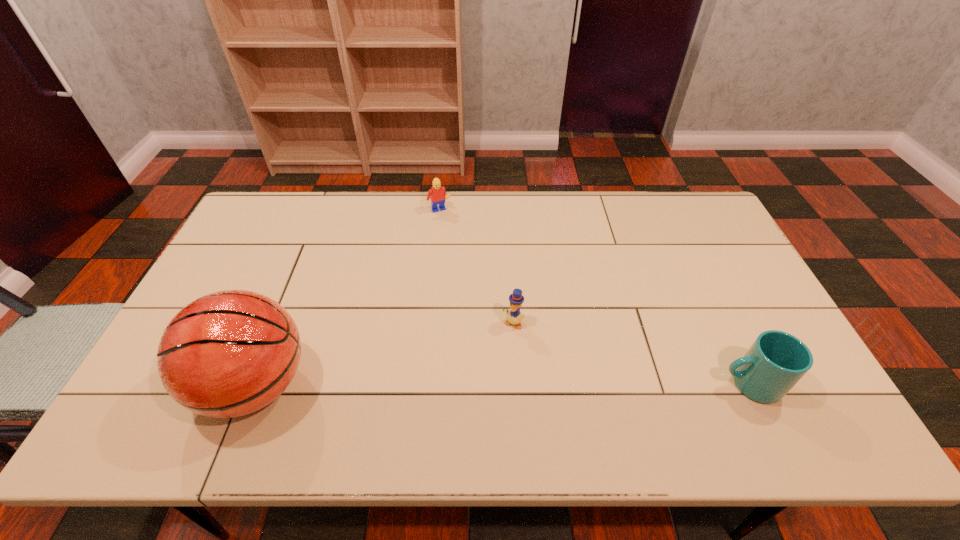
Locate an element on the screen. The image size is (960, 540). basketball is located at coordinates (230, 353).

What are the coordinates of `the tallest object` in the screenshot? It's located at (230, 353).

Locate an element on the screen. cup is located at coordinates (776, 361).

What are the coordinates of `Lego` in the screenshot? It's located at pos(437,194).

I want to click on the third object from right to left, so click(x=437, y=194).

This screenshot has height=540, width=960. What are the coordinates of `duckling` in the screenshot? It's located at (514, 316).

I want to click on the second object from right to left, so click(514, 316).

The width and height of the screenshot is (960, 540). In order to click on free spot located 0.120m on the side with spill of the basketball in this screenshot , I will do `click(150, 386)`.

Locate an element on the screen. This screenshot has width=960, height=540. vacant space located 0.310m on the handle side of the rightmost object is located at coordinates (591, 384).

Locate an element on the screen. Image resolution: width=960 pixels, height=540 pixels. free space located 0.390m on the handle side of the rightmost object is located at coordinates (559, 384).